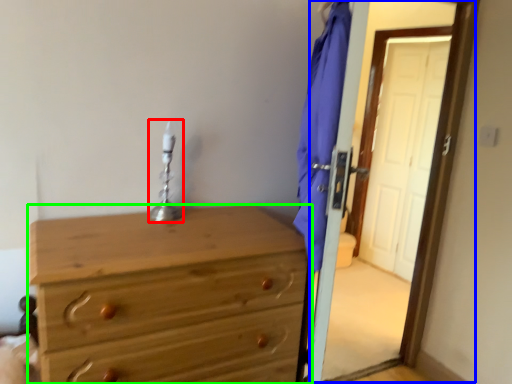
Question: Based on their relative distances, which object is farther from table lamp (highlighted by a red box)? Choose from screen door (highlighted by a blue box) and chest of drawers (highlighted by a green box).

Choices:
 (A) screen door
 (B) chest of drawers

Answer: (A)